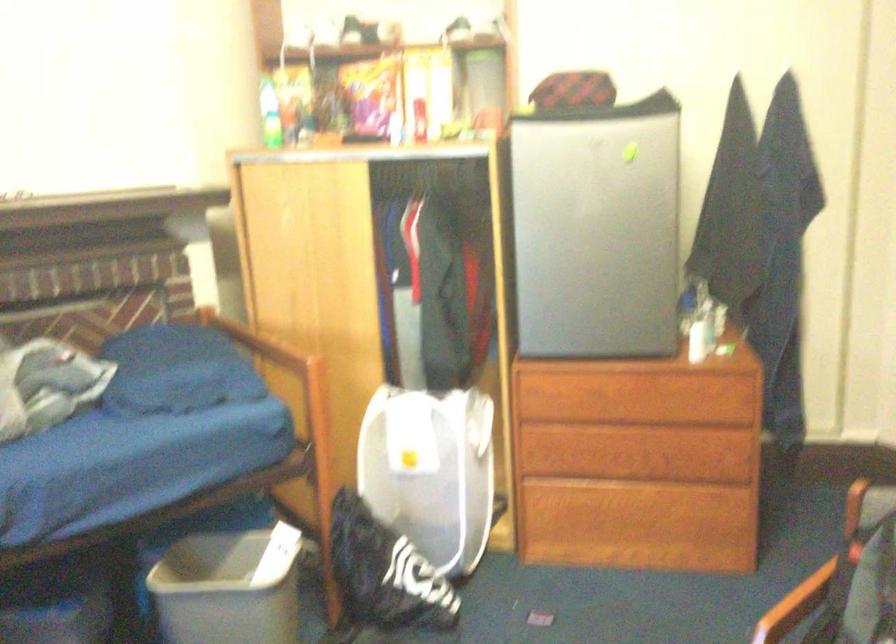
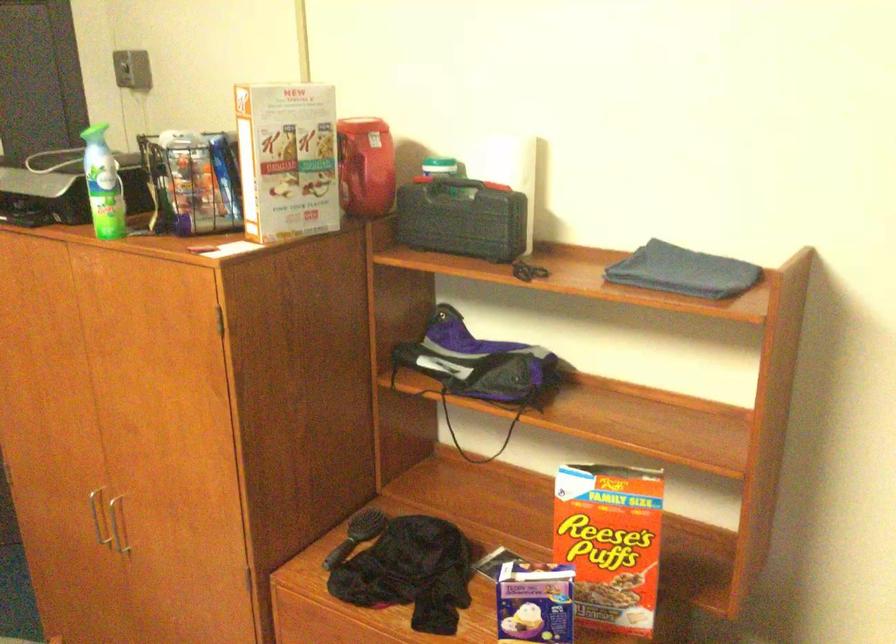
Question: The images are taken continuously from a first-person perspective. In which direction is your viewpoint rotating?

Choices:
 (A) Left
 (B) Right
 (C) Up
 (D) Down

Answer: (B)